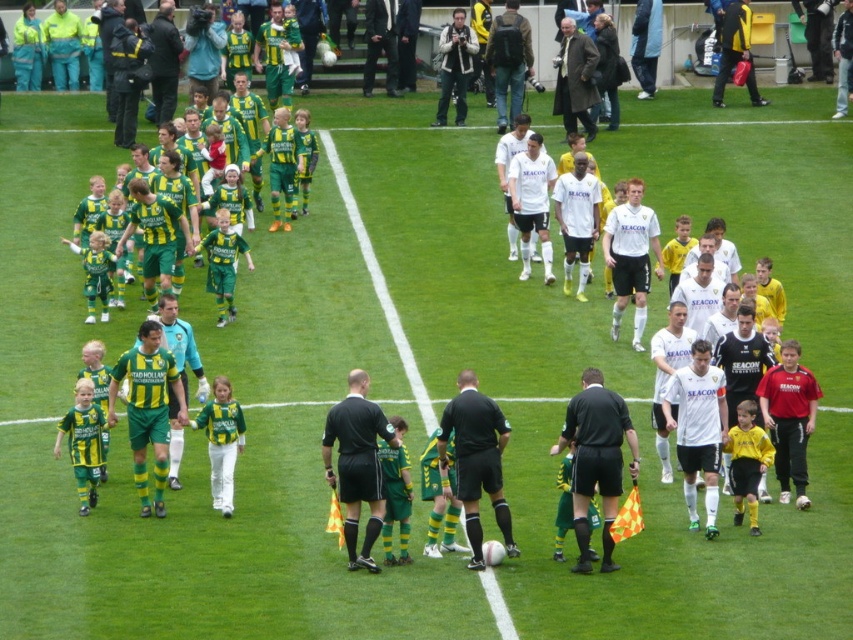
Question: Among these points, which one is farthest from the camera?

Choices:
 (A) (732, 38)
 (B) (834, 116)
 (C) (170, 33)
 (D) (589, 115)

Answer: (A)

Question: Is white leather jacket at center further to camera compared to dark blue jacket at upper left?

Choices:
 (A) yes
 (B) no

Answer: (A)

Question: Does black uniformed official at center appear on the right side of yellow jacket at center?

Choices:
 (A) no
 (B) yes

Answer: (A)

Question: Is black uniformed official at center smaller than white matte jersey at center?

Choices:
 (A) no
 (B) yes

Answer: (B)

Question: Among these objects, which one is nearest to the camera?

Choices:
 (A) dark blue jeans at center
 (B) black uniformed official at center
 (C) black smooth referee at center
 (D) dark gray pants at center

Answer: (C)

Question: Which object appears closest to the camera in this image?

Choices:
 (A) white leather jacket at center
 (B) dark blue jacket at upper left
 (C) yellow jacket at center
 (D) green jersey at center

Answer: (D)